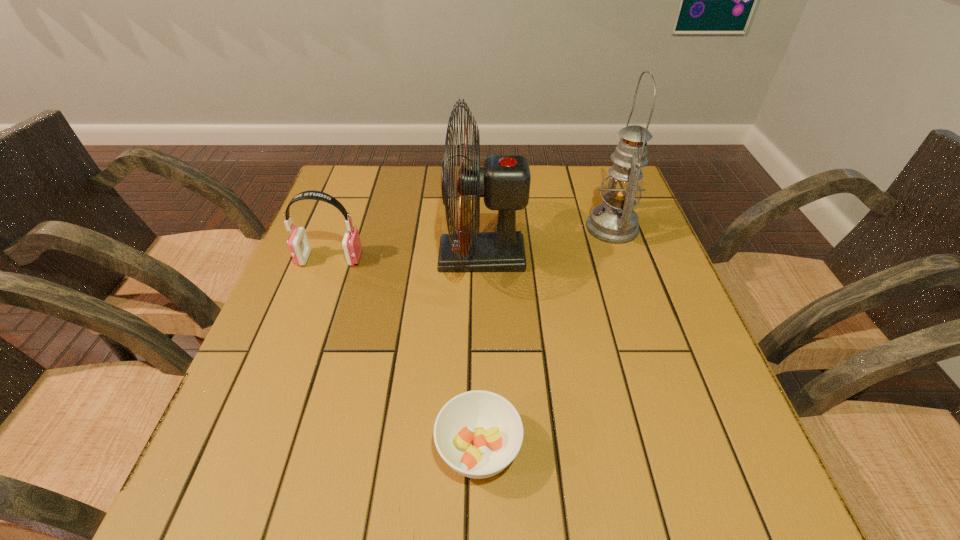
In order to click on free space at the right edge of the desktop in this screenshot , I will do `click(601, 256)`.

Where is `vacant space that's between the shortest object and the fan`? The image size is (960, 540). vacant space that's between the shortest object and the fan is located at coordinates (480, 353).

Locate an element on the screen. vacant space that's between the shortest object and the second shortest object is located at coordinates (404, 354).

This screenshot has width=960, height=540. Find the location of `free space between the nearest object and the third tallest object`. free space between the nearest object and the third tallest object is located at coordinates (404, 354).

At what (x,y) coordinates should I click in order to perform the action: click on free space between the second shortest object and the shortest object. Please return your answer as a coordinate pair (x, y). This screenshot has height=540, width=960. Looking at the image, I should click on (404, 354).

This screenshot has height=540, width=960. I want to click on free space that is in between the shortest object and the earphone, so click(404, 354).

You are a GUI agent. You are given a task and a screenshot of the screen. Output one action in this format:
    pyautogui.click(x=<x>, y=<y>)
    Task: Click on the free space between the earphone and the shortest object
    Image resolution: width=960 pixels, height=540 pixels.
    Given the screenshot: What is the action you would take?
    point(404,354)

Image resolution: width=960 pixels, height=540 pixels. In order to click on free space between the leftmost object and the fan in this screenshot , I will do `click(406, 258)`.

This screenshot has height=540, width=960. In order to click on empty space between the fan and the earphone in this screenshot , I will do click(x=406, y=258).

This screenshot has height=540, width=960. I want to click on empty space that is in between the nearest object and the earphone, so tap(404, 354).